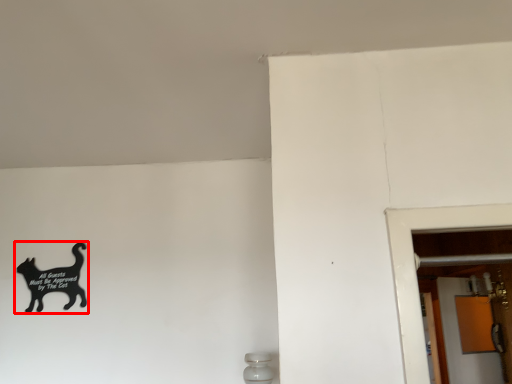
Question: From the image, what is the correct spatial relationship of cat (annotated by the red box) in relation to screen door?

Choices:
 (A) left
 (B) right

Answer: (A)